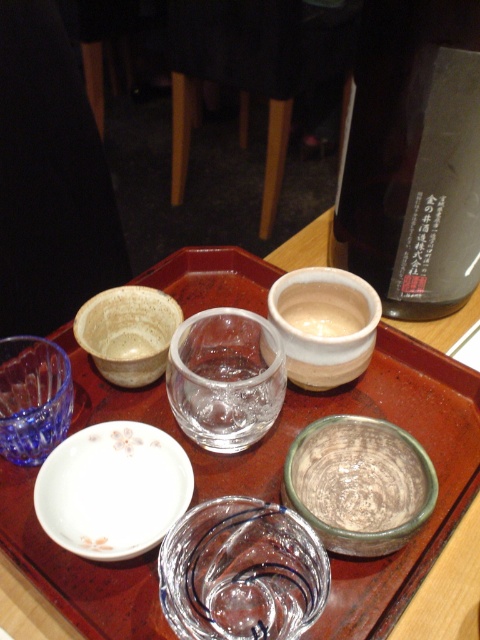
What object is located at the coordinates point (x=226, y=378)?

The transparent glass cup at center is located at point (x=226, y=378).

You are a server in a traditional Japanese restaurant and need to place a new item on the tray. You have a small wooden chopstick holder that is 10 cm tall. The green glazed bowl at lower center is 12 cm tall and the transparent glass cup at center is 8 cm tall. Can you safely place the chopstick holder between these two items without it toppling over?

The green glazed bowl at lower center is 12 cm tall and the transparent glass cup at center is 8 cm tall. Since the chopstick holder is 10 cm tall, it can be placed between them as it is shorter than the bowl and taller than the cup, maintaining stability.

You are a server in a Japanese restaurant and need to place a new item on the tray. You have a small plate that must be placed below the transparent glass cup at center. Where should you place it in relation to the blue glass bowl at lower left?

The small plate should be placed below the transparent glass cup at center, which is above the blue glass bowl at lower left. Therefore, the plate should be placed on or near the blue glass bowl at lower left to maintain the correct positioning.